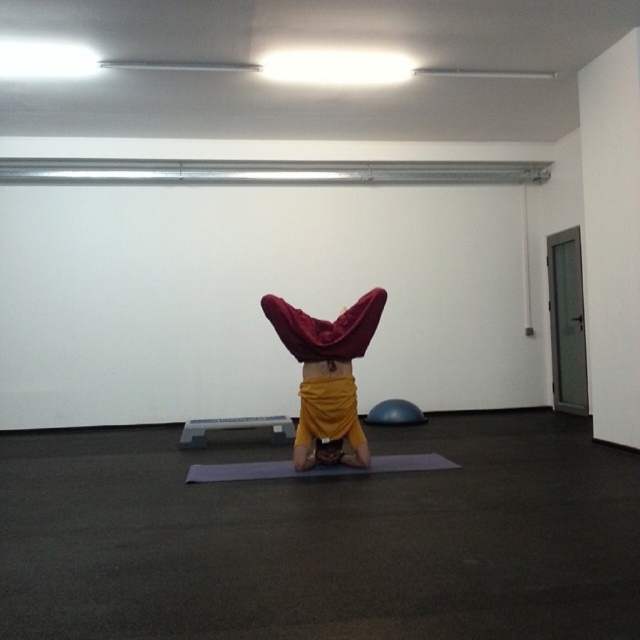
Locate an element on the screen. velvet red cloth at center is located at coordinates (326, 376).

Is velvet red cloth at center taller than gray rubber yoga mat at center?

Yes, velvet red cloth at center is taller than gray rubber yoga mat at center.

Who is more distant from viewer, [346,412] or [417,464]?

The point [417,464] is behind.

I want to click on velvet red cloth at center, so coord(326,376).

Between point (349, 452) and point (280, 422), which one is positioned behind?

Positioned behind is point (280, 422).

Identify the location of velvet red cloth at center. This screenshot has height=640, width=640. (326, 376).

The width and height of the screenshot is (640, 640). Identify the location of velvet red cloth at center. (326, 376).

Measure the distance between gray rubber yoga mat at center and camera.

gray rubber yoga mat at center and camera are 4.37 meters apart from each other.

Is gray rubber yoga mat at center positioned before gray plastic lift at center?

Yes.

Does point (374, 461) come closer to viewer compared to point (188, 436)?

Yes, point (374, 461) is closer to viewer.

Where is `gray rubber yoga mat at center`? gray rubber yoga mat at center is located at coordinates (312, 468).